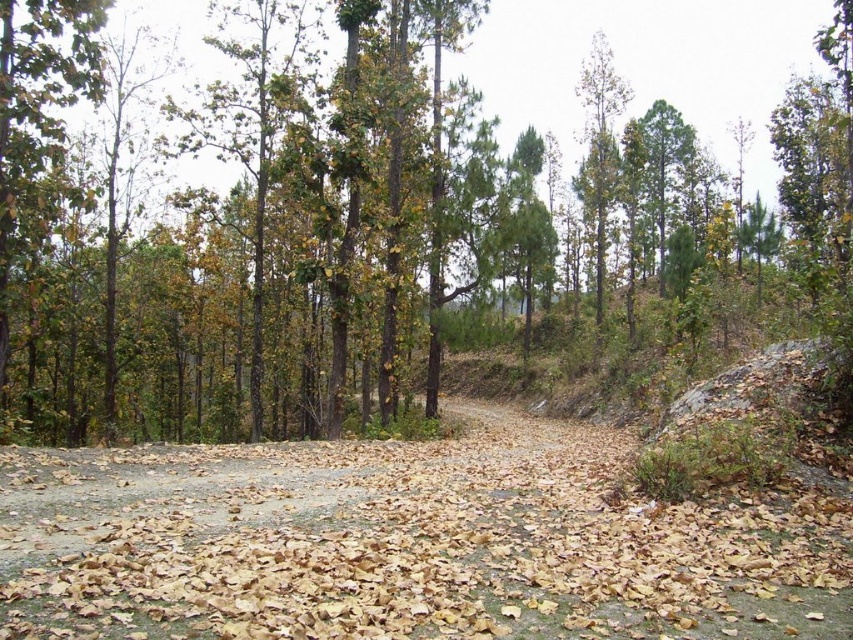
You are a hiker standing on the brown dirt track at center. You want to take a photo of the brown matte tree at center. Which direction should you face to ensure the tree is fully visible in your camera frame?

Since the brown matte tree at center is taller than the brown dirt track at center, you should face towards the direction where the tree stands to ensure it is fully visible in your camera frame.

You are standing on the dirt path in the forest and see two points marked on the ground. The first is at coordinate point (693, 172) and the second at point (747, 556). Which point is closer to you?

Point (693, 172) is closer to you because it is further to the viewer than point (747, 556).

You are standing at the point labeled as point (306, 221) in the image. What object are you directly at?

You are directly at the brown matte tree at center.